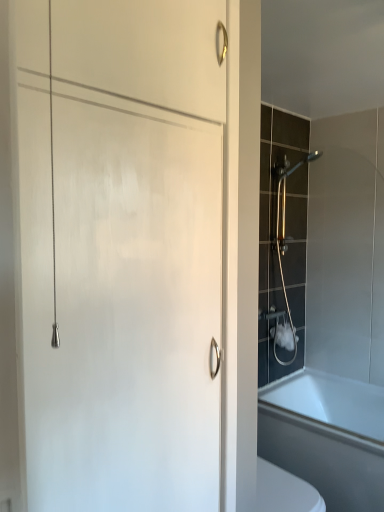
Question: In terms of height, does gold metallic shower at right look taller or shorter compared to white glossy bathtub at lower right?

Choices:
 (A) short
 (B) tall

Answer: (B)

Question: Considering the relative positions of gold metallic shower at right and white glossy bathtub at lower right in the image provided, is gold metallic shower at right to the left or to the right of white glossy bathtub at lower right?

Choices:
 (A) right
 (B) left

Answer: (B)

Question: In terms of width, does gold metallic shower at right look wider or thinner when compared to white glossy bathtub at lower right?

Choices:
 (A) thin
 (B) wide

Answer: (A)

Question: Choose the correct answer: Is white glossy bathtub at lower right inside gold metallic shower at right or outside it?

Choices:
 (A) outside
 (B) inside

Answer: (A)

Question: Is white glossy bathtub at lower right bigger or smaller than gold metallic shower at right?

Choices:
 (A) big
 (B) small

Answer: (A)

Question: Is point (314, 442) closer or farther from the camera than point (291, 324)?

Choices:
 (A) farther
 (B) closer

Answer: (B)

Question: Would you say white glossy bathtub at lower right is to the left or to the right of gold metallic shower at right in the picture?

Choices:
 (A) left
 (B) right

Answer: (B)